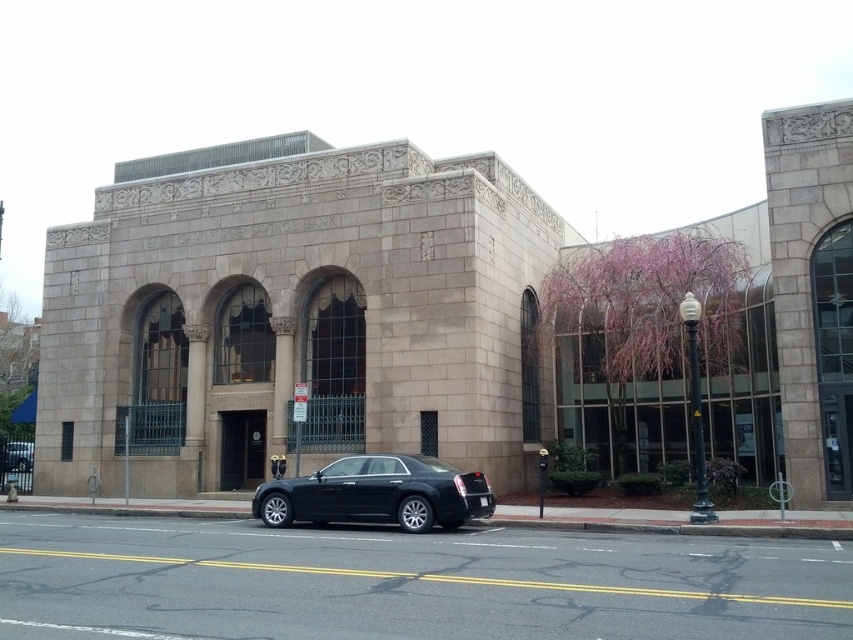
Question: Is black metallic sedan at center to the left of black glossy sedan at center from the viewer's perspective?

Choices:
 (A) no
 (B) yes

Answer: (A)

Question: Observing the image, what is the correct spatial positioning of black metallic sedan at center in reference to black glossy sedan at center?

Choices:
 (A) below
 (B) above

Answer: (B)

Question: Is black metallic sedan at center further to the viewer compared to black glossy sedan at center?

Choices:
 (A) yes
 (B) no

Answer: (B)

Question: Which of the following is the closest to the observer?

Choices:
 (A) (384, 474)
 (B) (26, 461)

Answer: (A)

Question: Which point is closer to the camera?

Choices:
 (A) (28, 461)
 (B) (434, 500)

Answer: (B)